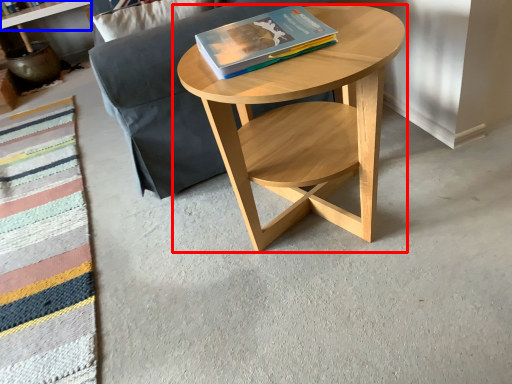
Question: Which object appears closest to the camera in this image, coffee table (highlighted by a red box) or shelf (highlighted by a blue box)?

Choices:
 (A) coffee table
 (B) shelf

Answer: (A)